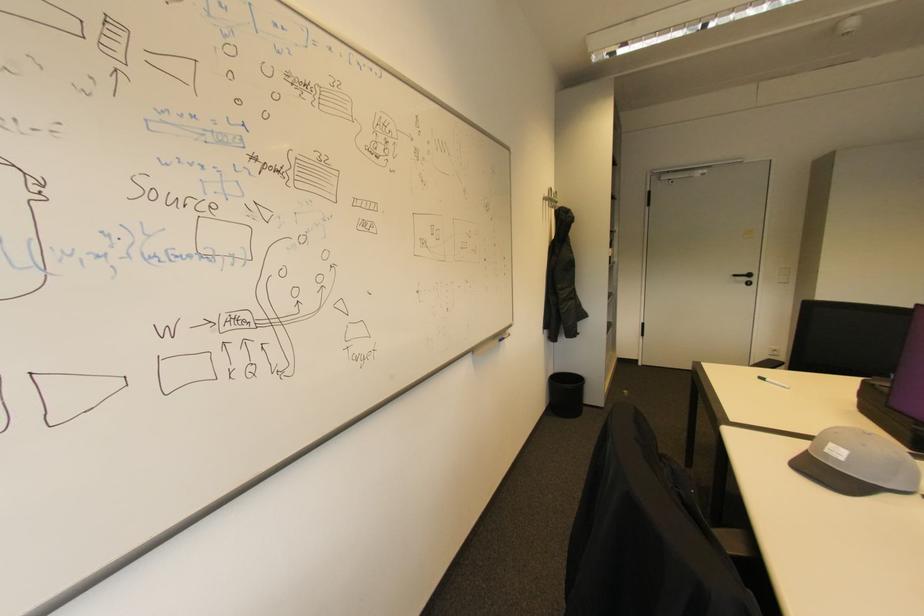
The height and width of the screenshot is (616, 924). Describe the element at coordinates (743, 277) in the screenshot. I see `the black door handle` at that location.